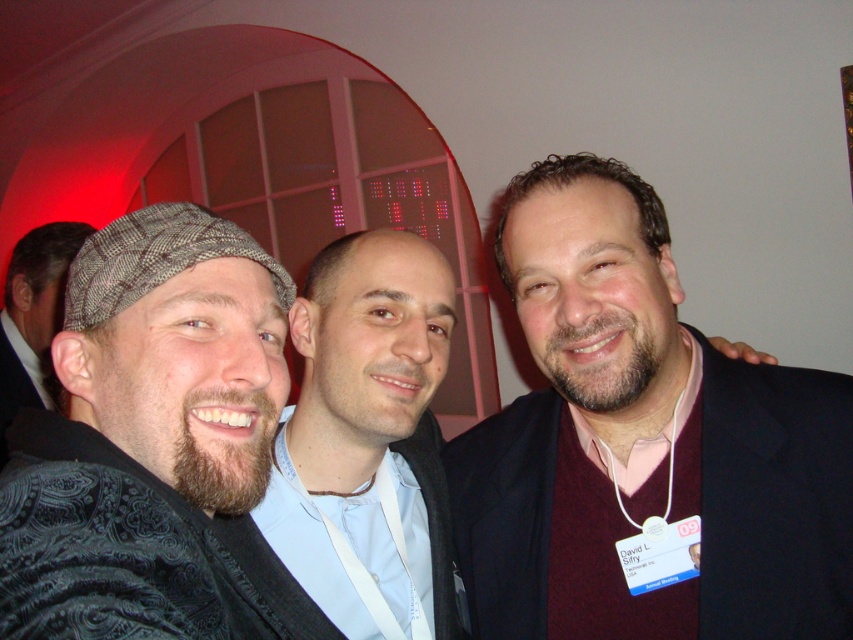
Looking at this image, does bearded man at center have a larger size compared to bearded man with textured hat at left?

No.

Find the location of a particular element. bearded man at center is located at coordinates (360, 451).

Find the location of a particular element. The height and width of the screenshot is (640, 853). bearded man at center is located at coordinates (360, 451).

Is dark gray textured cap at left bigger than bearded man at center?

Actually, dark gray textured cap at left might be smaller than bearded man at center.

Is dark gray textured cap at left positioned in front of bearded man at center?

Yes, it is in front of bearded man at center.

Is point (238, 280) farther from viewer compared to point (315, 544)?

No, (238, 280) is in front of (315, 544).

Identify the location of dark gray textured cap at left. The image size is (853, 640). (148, 436).

Does maroon sweater at right have a lesser width compared to bearded man with textured hat at left?

Yes.

Does maroon sweater at right appear under bearded man with textured hat at left?

No.

Is point (645, 355) in front of point (39, 339)?

Yes.

I want to click on maroon sweater at right, so click(x=641, y=442).